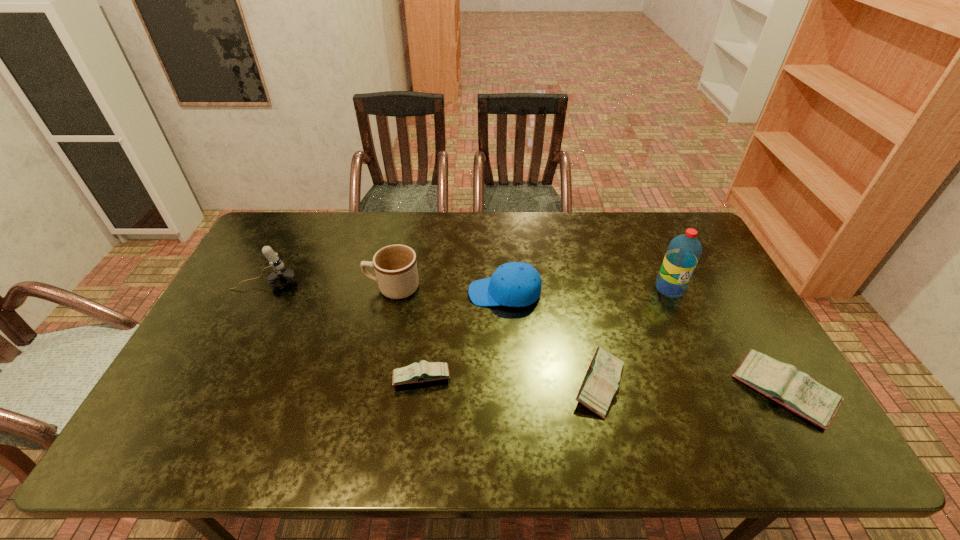
Image resolution: width=960 pixels, height=540 pixels. I want to click on free space at the far left corner of the desktop, so click(290, 245).

The image size is (960, 540). I want to click on unoccupied area between the sixth shortest object and the fifth shortest object, so click(329, 286).

I want to click on vacant point located between the leftmost object and the tallest object, so click(468, 286).

You are a GUI agent. You are given a task and a screenshot of the screen. Output one action in this format:
    pyautogui.click(x=<x>, y=<y>)
    Task: Click on the vacant point located between the water bottle and the fifth object from left to right
    
    Given the screenshot: What is the action you would take?
    pyautogui.click(x=635, y=336)

This screenshot has height=540, width=960. I want to click on vacant space in between the fourth object from left to right and the leftmost diary, so click(x=464, y=335).

The image size is (960, 540). Identify the location of free space between the tallest object and the second diary from right to left. pyautogui.click(x=635, y=336).

Where is `free space between the rightmost diary and the second diary from right to left`? This screenshot has height=540, width=960. free space between the rightmost diary and the second diary from right to left is located at coordinates (691, 388).

The height and width of the screenshot is (540, 960). I want to click on unoccupied position between the fourth tallest object and the second tallest diary, so click(x=552, y=339).

This screenshot has height=540, width=960. What are the coordinates of `free point between the tallest diary and the third tallest object` in the screenshot? It's located at (588, 340).

Find the location of a particular element. The image size is (960, 540). blank region between the sixth shortest object and the tallest diary is located at coordinates (523, 338).